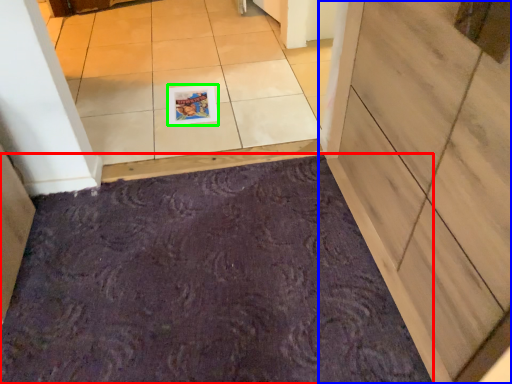
Question: Based on their relative distances, which object is farther from bath mat (highlighted by a red box)? Choose from door (highlighted by a blue box) and postcard (highlighted by a green box).

Choices:
 (A) door
 (B) postcard

Answer: (B)